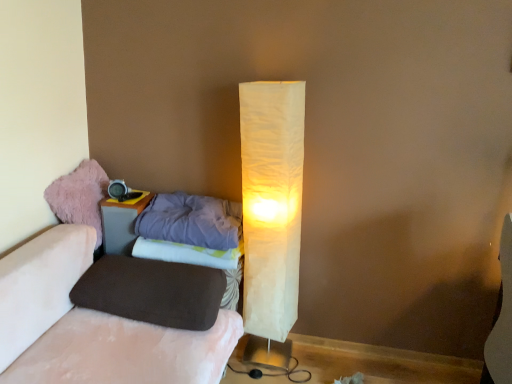
Identify the location of empty space that is ontop of matte gray nightstand at left (from a real-world perspective). The height and width of the screenshot is (384, 512). (129, 197).